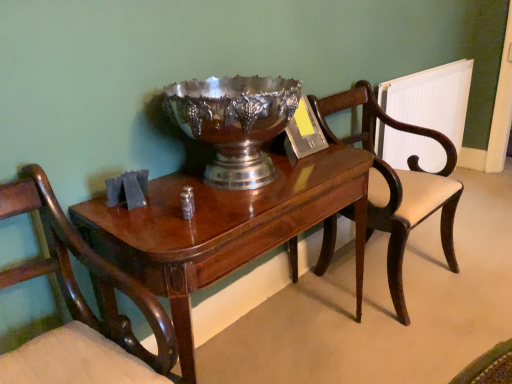
This screenshot has width=512, height=384. Identify the location of vacant region in front of shiny silver bowl at center. (195, 221).